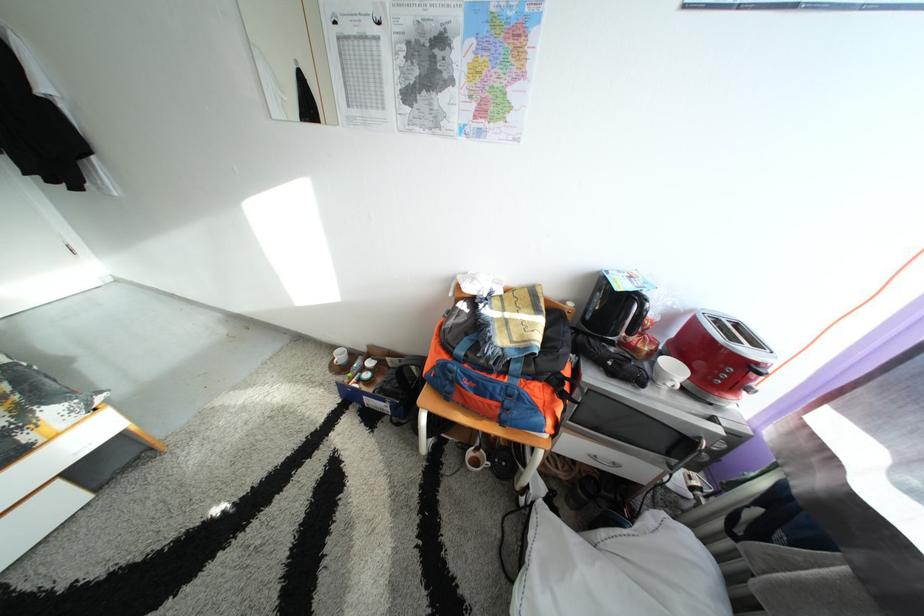
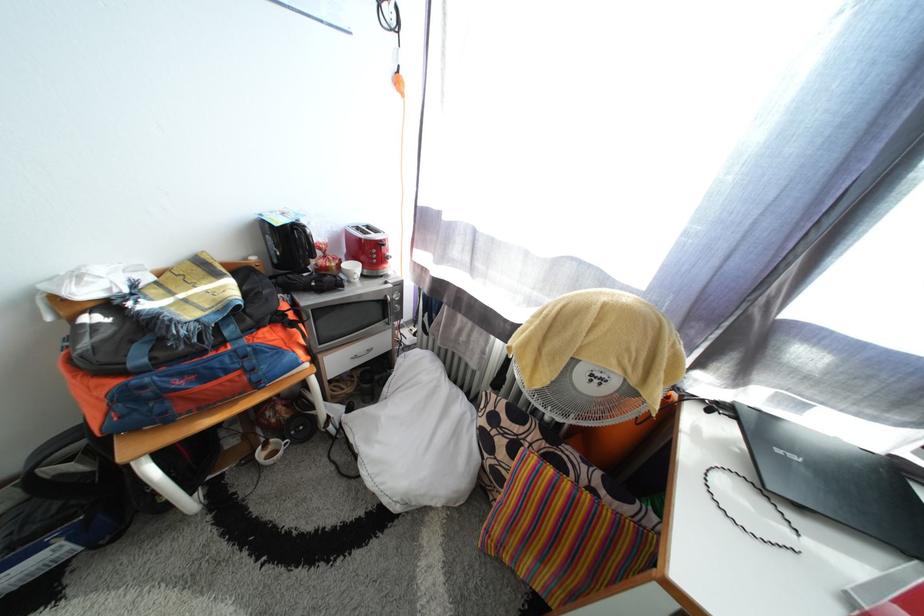
The point at (755, 357) is marked in the first image. Where is the corresponding point in the second image?

(383, 243)